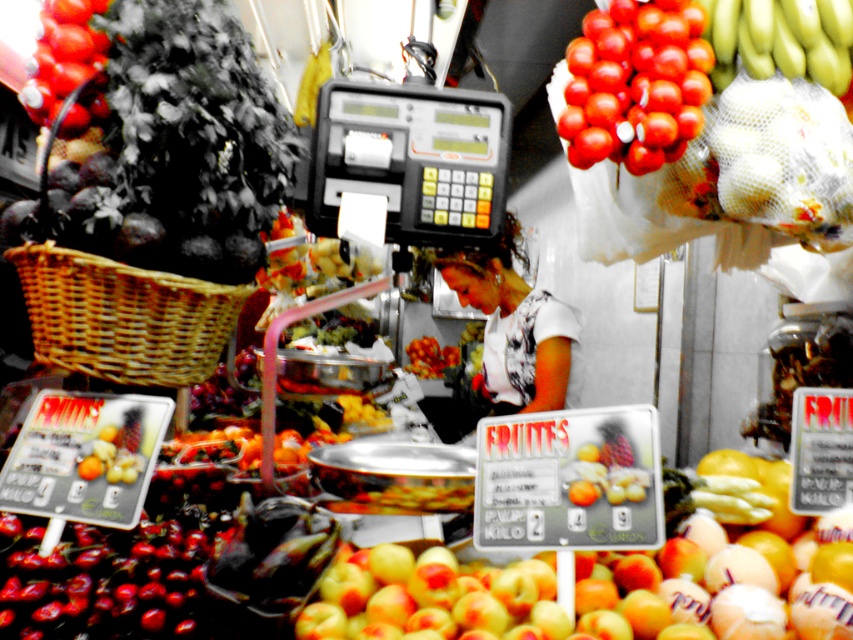
Question: Which of these objects is positioned farthest from the woven brown basket at lower left?

Choices:
 (A) shiny red tomatoes at upper right
 (B) shiny green bananas at upper right

Answer: (B)

Question: Which object is positioned farthest from the woven brown basket at lower left?

Choices:
 (A) black plastic scale at center
 (B) smooth red tomato at upper left

Answer: (A)

Question: Does woven brown basket at lower left have a lesser width compared to smooth red tomato at upper left?

Choices:
 (A) yes
 (B) no

Answer: (B)

Question: Which object appears farthest from the camera in this image?

Choices:
 (A) shiny green bananas at upper right
 (B) shiny red tomatoes at upper right

Answer: (A)

Question: Where is woven brown basket at lower left located in relation to shiny green bananas at upper right in the image?

Choices:
 (A) above
 (B) below

Answer: (B)

Question: Where is woven brown basket at lower left located in relation to shiny red tomatoes at upper right in the image?

Choices:
 (A) right
 (B) left

Answer: (B)